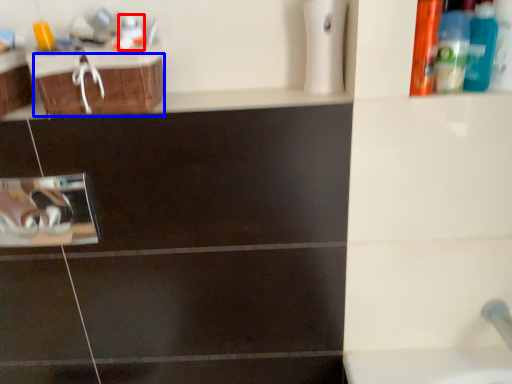
Question: Which object appears farthest to the camera in this image, mouthwash (highlighted by a red box) or drawer (highlighted by a blue box)?

Choices:
 (A) mouthwash
 (B) drawer

Answer: (A)